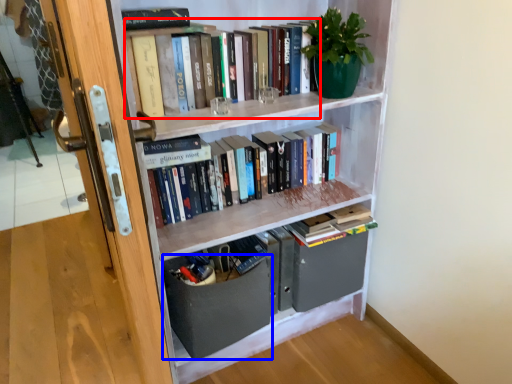
Question: Which object appears closest to the camera in this image, book (highlighted by a red box) or drawer (highlighted by a blue box)?

Choices:
 (A) book
 (B) drawer

Answer: (A)